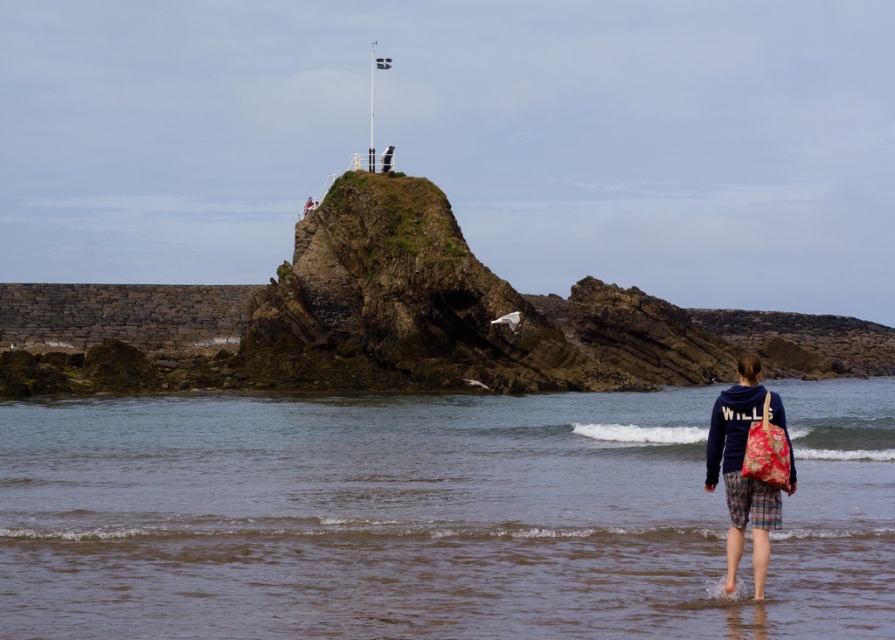
You are a photographer trying to capture a clear shot of the flagpole on the rocky outcrop. You are standing on the brown sand at lower center and want to move towards the dark blue fleece jacket at lower center. Is the jacket blocking your path to the flagpole?

The brown sand at lower center is in front of the dark blue fleece jacket at lower center, meaning the jacket is behind you. Moving towards the jacket would take you away from the flagpole, so the jacket is not blocking your path. You should move in the opposite direction to get a clearer shot.

You are a photographer trying to capture the scene of the rocky outcrop and the flagpole. You notice the brown sand at lower center and the dark blue fleece jacket at lower center in your frame. Which object is positioned lower in the image?

The brown sand at lower center is positioned below the dark blue fleece jacket at lower center, so it is lower in the image.